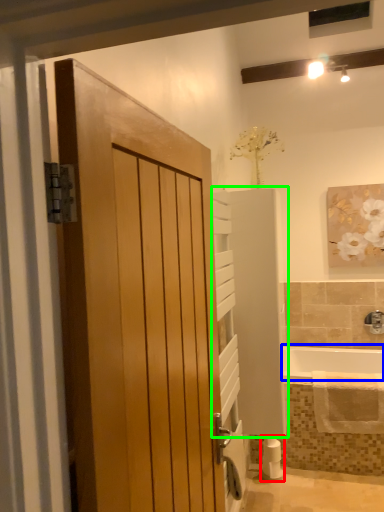
Question: Considering the real-world distances, which object is farthest from toilet paper (highlighted by a red box)? bath (highlighted by a blue box) or elevator (highlighted by a green box)?

Choices:
 (A) bath
 (B) elevator

Answer: (B)